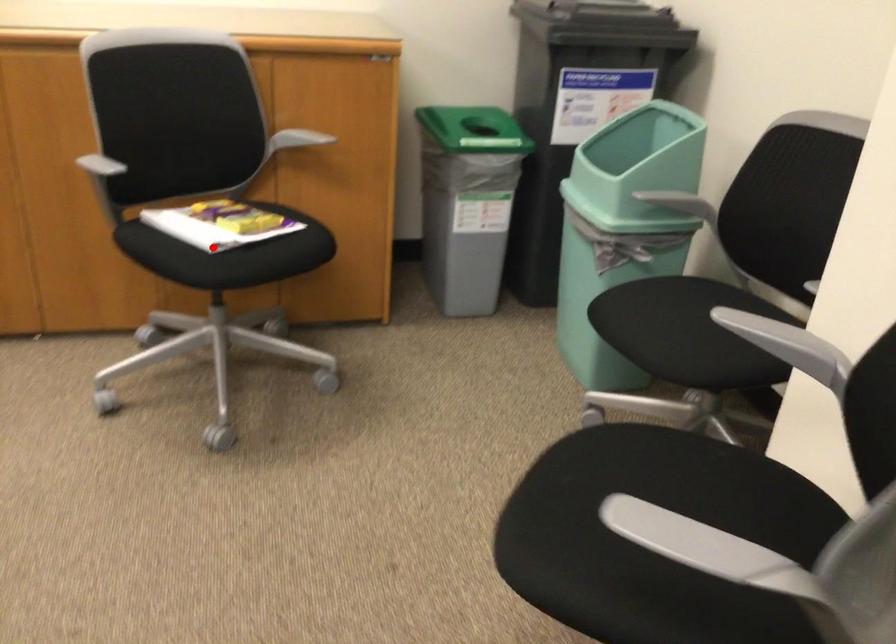
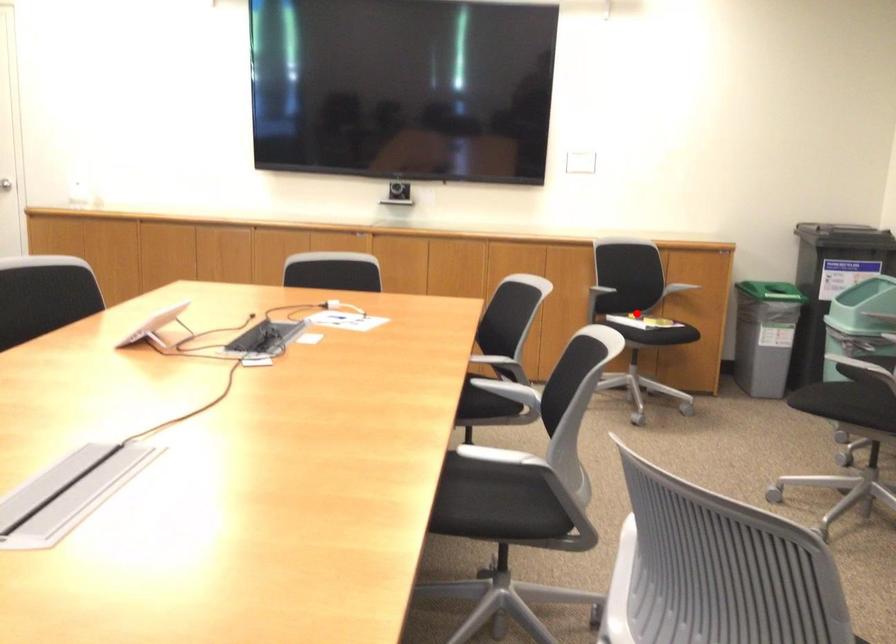
I am providing you with two images of the same scene from different viewpoints. A red point is marked on the first image and another point is marked on the second image. Is the red point in image1 aligned with the point shown in image2?

Yes